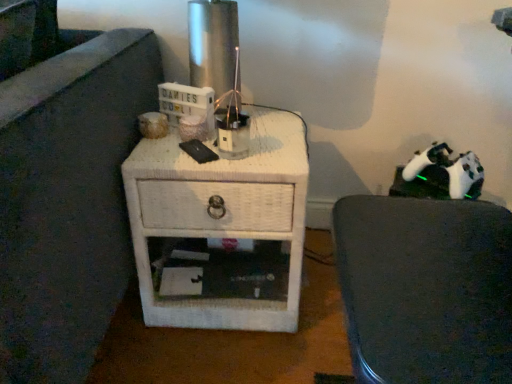
Question: Does white matte chair at right have a lesser height compared to white wicker nightstand at center?

Choices:
 (A) yes
 (B) no

Answer: (B)

Question: From the image's perspective, is white matte chair at right below white wicker nightstand at center?

Choices:
 (A) no
 (B) yes

Answer: (B)

Question: Is white matte chair at right behind white wicker nightstand at center?

Choices:
 (A) yes
 (B) no

Answer: (B)

Question: Does white matte chair at right have a larger size compared to white wicker nightstand at center?

Choices:
 (A) no
 (B) yes

Answer: (A)

Question: Can you confirm if white matte chair at right is positioned to the right of white wicker nightstand at center?

Choices:
 (A) no
 (B) yes

Answer: (B)

Question: Does white matte chair at right have a smaller size compared to white wicker nightstand at center?

Choices:
 (A) no
 (B) yes

Answer: (B)

Question: From a real-world perspective, is white wicker nightstand at center physically above white matte chair at right?

Choices:
 (A) no
 (B) yes

Answer: (A)

Question: Is white wicker nightstand at center oriented towards white matte chair at right?

Choices:
 (A) yes
 (B) no

Answer: (B)

Question: Considering the relative positions of white wicker nightstand at center and white matte chair at right in the image provided, is white wicker nightstand at center in front of white matte chair at right?

Choices:
 (A) yes
 (B) no

Answer: (B)

Question: From the image's perspective, does white wicker nightstand at center appear higher than white matte chair at right?

Choices:
 (A) yes
 (B) no

Answer: (A)

Question: From a real-world perspective, is white wicker nightstand at center physically below white matte chair at right?

Choices:
 (A) no
 (B) yes

Answer: (B)

Question: Is white wicker nightstand at center positioned behind white matte chair at right?

Choices:
 (A) yes
 (B) no

Answer: (A)

Question: Is white matte chair at right taller or shorter than white wicker nightstand at center?

Choices:
 (A) short
 (B) tall

Answer: (B)